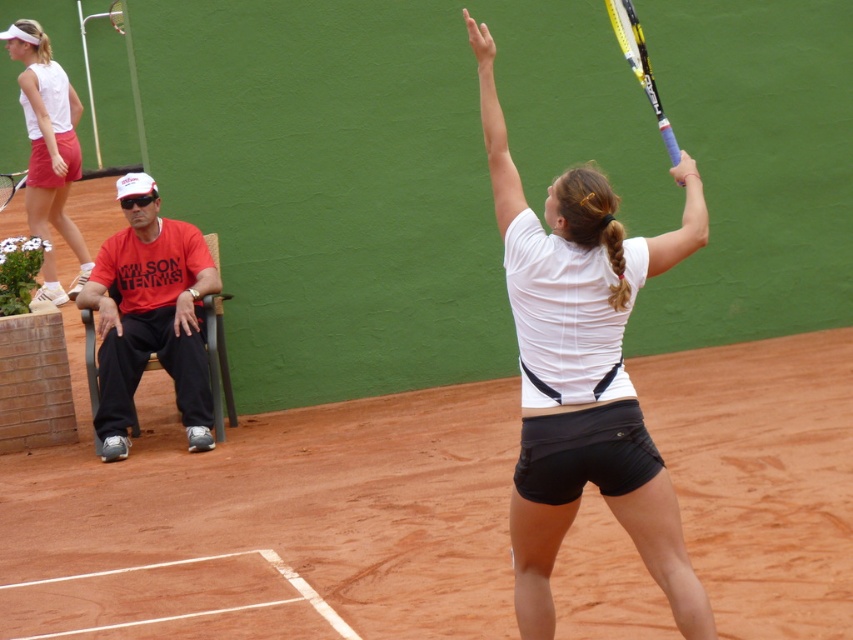
Question: Which object is positioned farthest from the yellow and black racket at upper right?

Choices:
 (A) matte white tank top at upper left
 (B) black matte tennis racket at upper center
 (C) white matte tennis racket at upper center

Answer: (B)

Question: Is yellow and black racket at upper right thinner than black matte tennis racket at upper center?

Choices:
 (A) no
 (B) yes

Answer: (B)

Question: Which object appears closest to the camera in this image?

Choices:
 (A) clay tennis court at center
 (B) white matte tennis racket at upper center

Answer: (B)

Question: Which of the following is the closest to the observer?

Choices:
 (A) (436, 480)
 (B) (628, 42)
 (C) (573, 291)

Answer: (C)

Question: From the image, what is the correct spatial relationship of white matte tennis racket at upper center in relation to black matte tennis racket at upper center?

Choices:
 (A) below
 (B) above

Answer: (A)

Question: Does clay tennis court at center have a smaller size compared to white matte tennis racket at upper center?

Choices:
 (A) yes
 (B) no

Answer: (A)